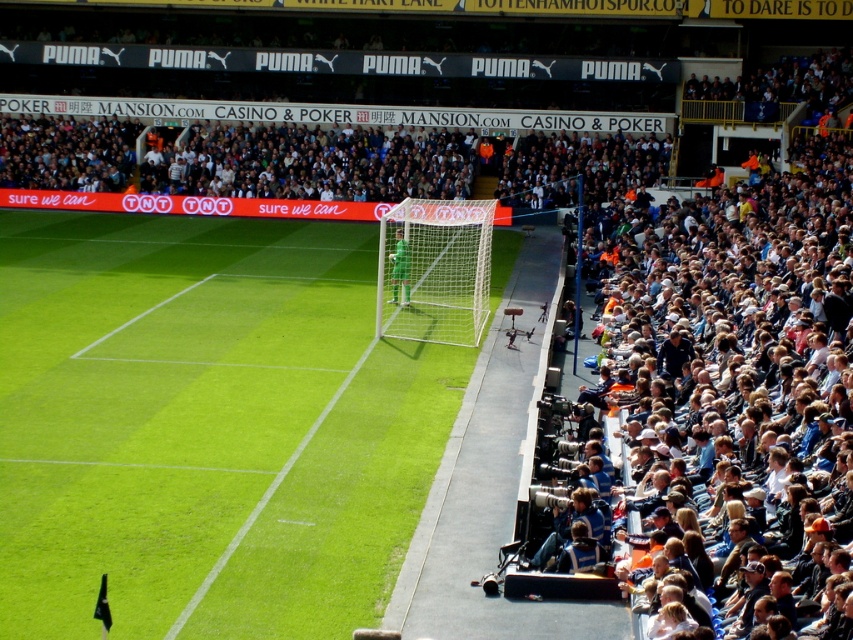
You are a soccer ball that just went out of bounds. You want to return to the playing area. Which object, the green grass at center or the white net at center, should you aim for to be back in the game?

The green grass at center is part of the playing area, so the soccer ball should aim for the green grass at center to return to the game. The white net at center is part of the goalpost and is outside the playing field.